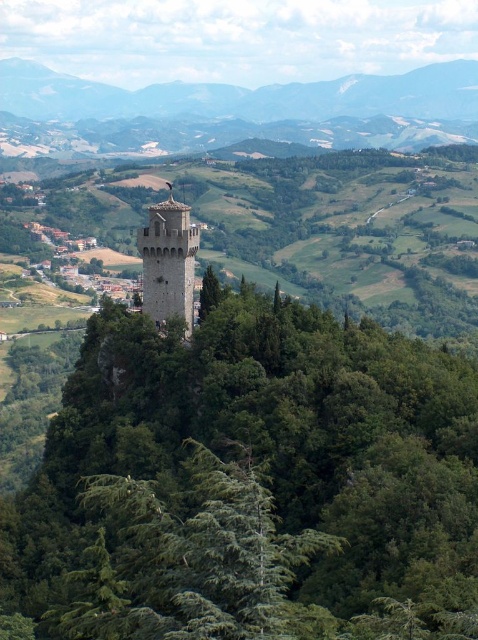
You are standing at the base of the hill looking up at the historic stone tower. You notice two points marked in the image. One is at coordinates point [442,576] and the other is at point [152,260]. Which point is nearer to your current position?

Point [442,576] is closer to the camera than point [152,260], so the point at coordinates point [442,576] is nearer to your current position.

You are an architect designing a new observatory that needs to be taller than the green leafy tree at center. Can you build it so that it also doesn not exceed the height of the smooth gray mountain at upper center?

The green leafy tree at center is shorter than the smooth gray mountain at upper center. Therefore, you can design the observatory to be taller than the green leafy tree at center but shorter than the smooth gray mountain at upper center to meet both requirements.